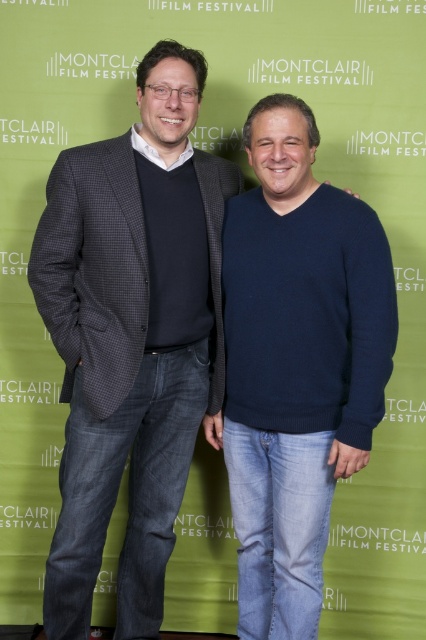
Question: Is dark gray textured blazer at left positioned before dark blue sweater at center?

Choices:
 (A) no
 (B) yes

Answer: (A)

Question: Can you confirm if dark gray textured blazer at left is positioned above dark blue sweater at center?

Choices:
 (A) no
 (B) yes

Answer: (B)

Question: Which of the following is the farthest from the observer?

Choices:
 (A) dark blue sweater at center
 (B) dark gray textured blazer at left

Answer: (B)

Question: Does dark gray textured blazer at left have a greater width compared to dark blue sweater at center?

Choices:
 (A) no
 (B) yes

Answer: (B)

Question: Which object appears closest to the camera in this image?

Choices:
 (A) dark gray textured blazer at left
 (B) dark blue sweater at center

Answer: (B)

Question: Which of the following is the farthest from the observer?

Choices:
 (A) dark blue sweater at center
 (B) dark gray textured blazer at left

Answer: (B)